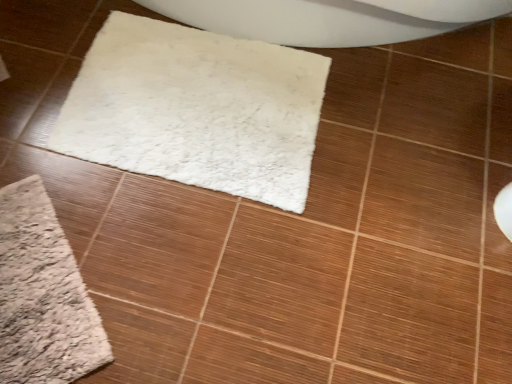
Where is `free location to the left of white fluffy mat at center`? Image resolution: width=512 pixels, height=384 pixels. free location to the left of white fluffy mat at center is located at coordinates (48, 75).